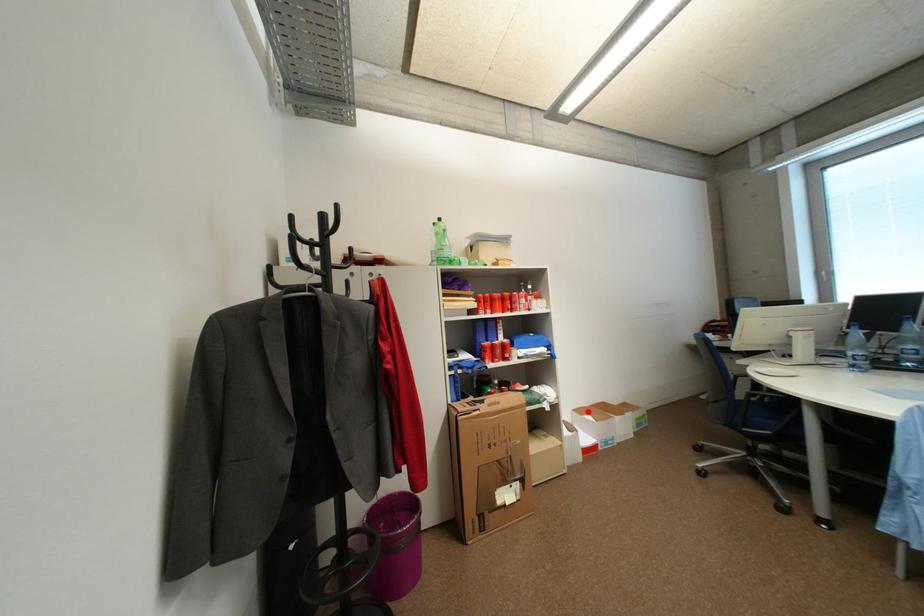
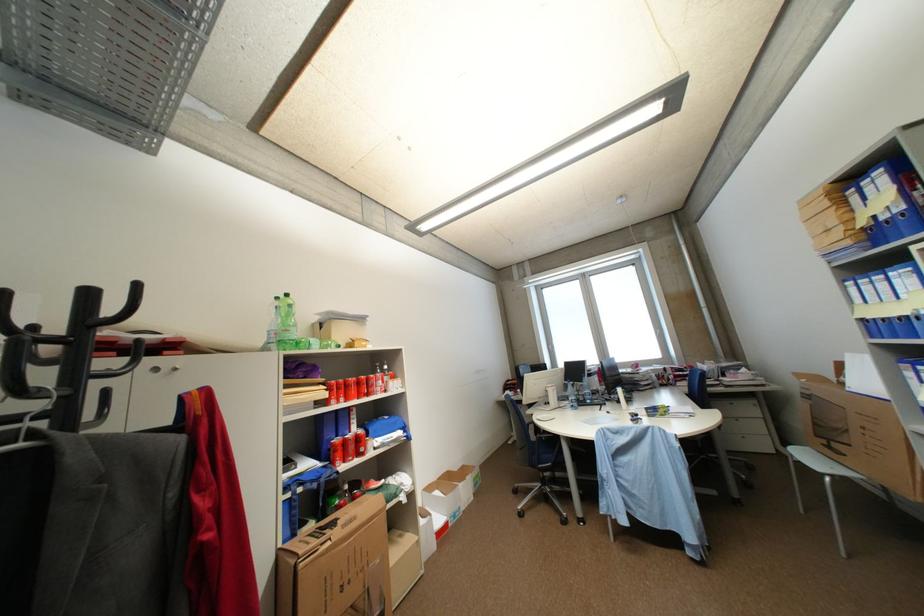
Question: I am providing you with two images of the same scene from different viewpoints. A red point is marked on the first image. At the location where the point appears in image 1, is it still visible in image 2?

Choices:
 (A) Yes
 (B) No

Answer: (A)